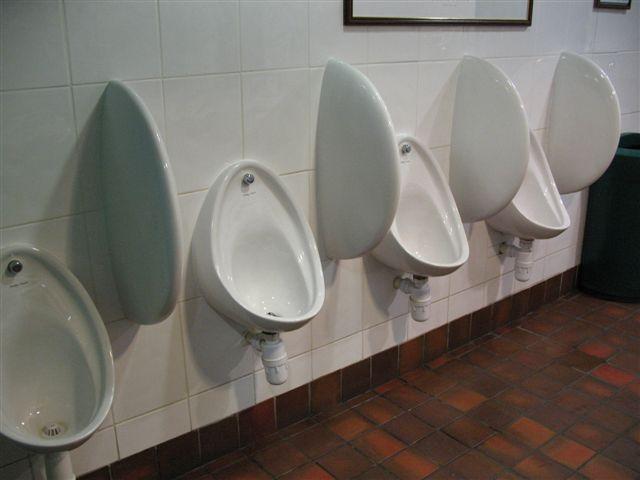
I want to click on shadows of dividers, so click(97, 272), click(333, 265).